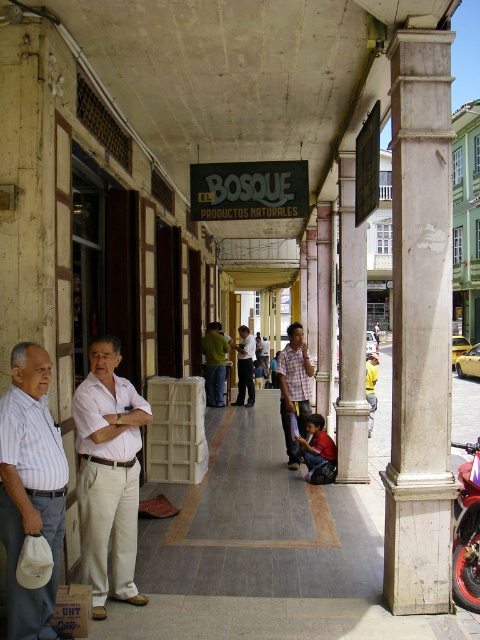
Question: Does green fabric shirt at center have a greater width compared to light brown leather jacket at center?

Choices:
 (A) no
 (B) yes

Answer: (B)

Question: Which object is positioned farthest from the smooth concrete pavement at center?

Choices:
 (A) metallic silver motorcycle at right
 (B) yellow fabric at center

Answer: (A)

Question: Is white marble column at right in front of yellow fabric at center?

Choices:
 (A) no
 (B) yes

Answer: (B)

Question: Considering the real-world distances, which object is farthest from the white marble pillar at center?

Choices:
 (A) metallic silver motorcycle at right
 (B) white marble column at center

Answer: (B)

Question: Which point is farther from the camera taking this photo?

Choices:
 (A) (479, 461)
 (B) (468, 413)
 (C) (402, 230)
 (D) (374, 403)

Answer: (B)

Question: Can you confirm if white marble column at right is thinner than light brown leather jacket at center?

Choices:
 (A) yes
 (B) no

Answer: (B)